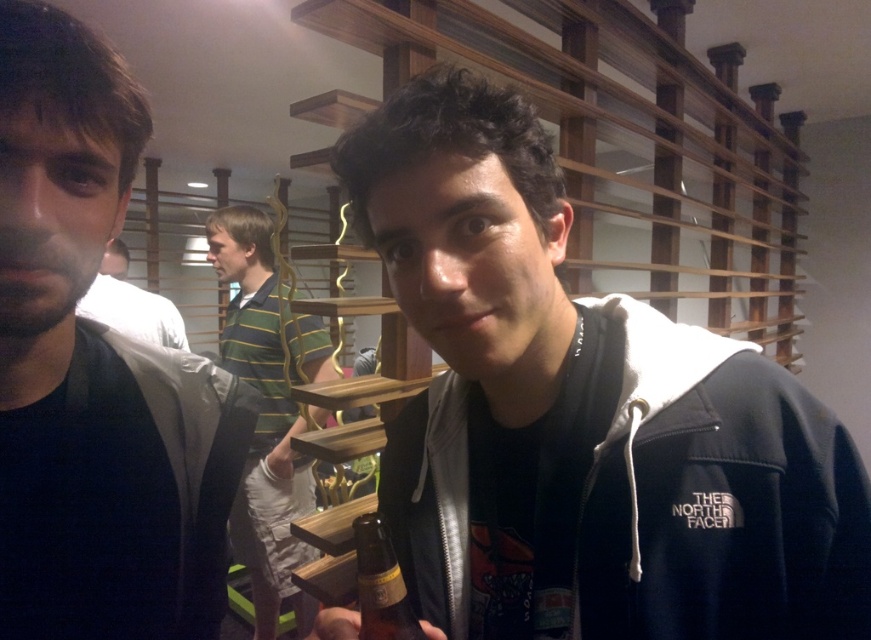
Question: Can you confirm if black matte hoodie at center is positioned below green striped shirt at center?

Choices:
 (A) no
 (B) yes

Answer: (A)

Question: Among these points, which one is nearest to the camera?

Choices:
 (A) (152, 308)
 (B) (245, 374)

Answer: (B)

Question: Which object is positioned farthest from the dark brown hair at left?

Choices:
 (A) green striped shirt at center
 (B) black matte hoodie at center
 (C) white matte shirt at center

Answer: (C)

Question: Among these points, which one is farthest from the camera?

Choices:
 (A) coord(503,349)
 (B) coord(167,317)
 (C) coord(69,291)

Answer: (B)

Question: Does black matte hoodie at center have a lesser width compared to white matte shirt at center?

Choices:
 (A) yes
 (B) no

Answer: (A)

Question: Observing the image, what is the correct spatial positioning of black matte hoodie at center in reference to green striped shirt at center?

Choices:
 (A) left
 (B) right

Answer: (B)